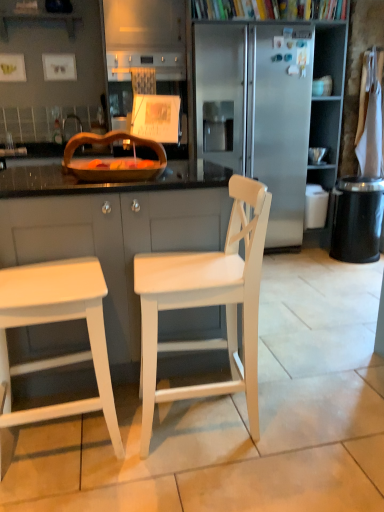
Question: Is stainless steel refrigerator at center wider or thinner than white matte stool at left?

Choices:
 (A) wide
 (B) thin

Answer: (A)

Question: Relative to white matte stool at left, is stainless steel refrigerator at center in front or behind?

Choices:
 (A) front
 (B) behind

Answer: (B)

Question: Estimate the real-world distances between objects in this image. Which object is farther from the white matte stool at left?

Choices:
 (A) brushed metal faucet at upper center
 (B) white wood cabinet at center
 (C) stainless steel refrigerator at center
 (D) wooden tray at center
 (E) white matte chair at center

Answer: (A)

Question: Which of these objects is positioned closest to the white matte chair at center?

Choices:
 (A) wooden tray at center
 (B) white matte stool at left
 (C) white wood cabinet at center
 (D) black textured trash can at right
 (E) brushed metal faucet at upper center

Answer: (C)